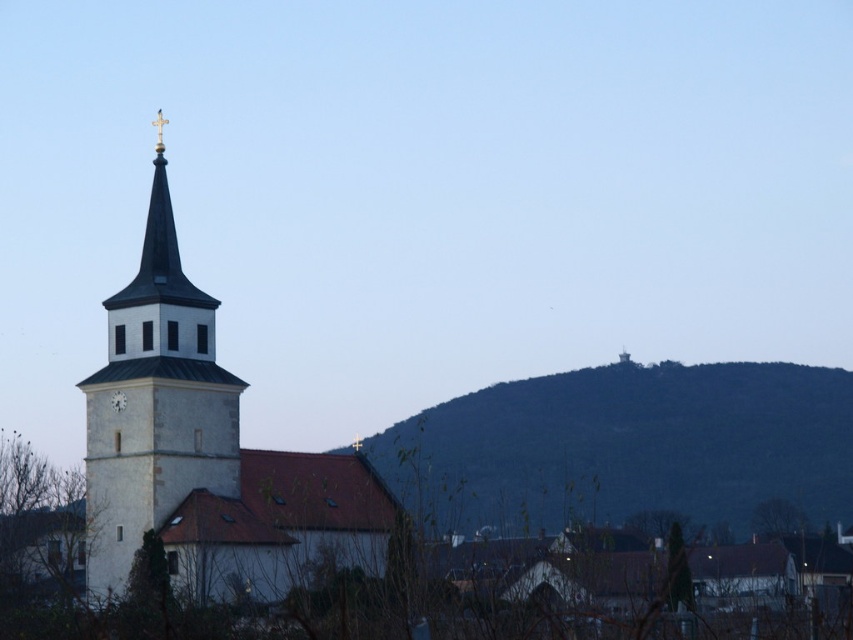
Consider the image. Between green textured hill at center and white matte clock at center-left, which one has more height?

green textured hill at center

Find the location of a particular element. The height and width of the screenshot is (640, 853). green textured hill at center is located at coordinates (627, 445).

In the scene shown: Is green textured hill at center wider than white stone bell tower at left?

Yes, green textured hill at center is wider than white stone bell tower at left.

Locate an element on the screen. The height and width of the screenshot is (640, 853). green textured hill at center is located at coordinates (627, 445).

Is point (720, 401) less distant than point (163, 404)?

No.

Where is `green textured hill at center`? green textured hill at center is located at coordinates (627, 445).

Can you confirm if white stone bell tower at left is smaller than white matte clock at center-left?

Actually, white stone bell tower at left might be larger than white matte clock at center-left.

Where is `white stone bell tower at left`? The width and height of the screenshot is (853, 640). white stone bell tower at left is located at coordinates (155, 403).

The height and width of the screenshot is (640, 853). Identify the location of white stone bell tower at left. 155,403.